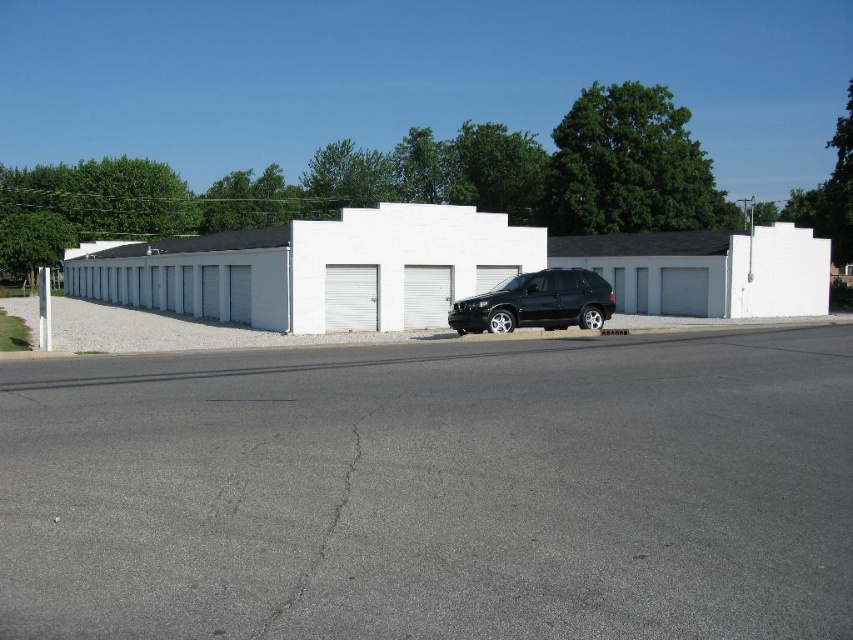
Find the location of `black matte suv at center`. black matte suv at center is located at coordinates click(537, 301).

Does black matte suv at center appear under gray metallic garage door at center?

Indeed, black matte suv at center is positioned under gray metallic garage door at center.

Is point (607, 292) farther from camera compared to point (677, 301)?

No.

You are a GUI agent. You are given a task and a screenshot of the screen. Output one action in this format:
    pyautogui.click(x=<x>, y=<y>)
    Task: Click on the black matte suv at center
    Image resolution: width=853 pixels, height=640 pixels.
    Given the screenshot: What is the action you would take?
    pyautogui.click(x=537, y=301)

Between black matte suv at center and white rolling door at center, which one appears on the right side from the viewer's perspective?

From the viewer's perspective, black matte suv at center appears more on the right side.

Describe the element at coordinates (537, 301) in the screenshot. I see `black matte suv at center` at that location.

Who is more forward, (469, 332) or (431, 292)?

Positioned in front is point (469, 332).

Find the location of a particular element. The image size is (853, 640). black matte suv at center is located at coordinates (537, 301).

The height and width of the screenshot is (640, 853). What do you see at coordinates (399, 264) in the screenshot? I see `white matte garage door at center` at bounding box center [399, 264].

Is white matte garage door at center to the right of white metallic garage door at center from the viewer's perspective?

Correct, you'll find white matte garage door at center to the right of white metallic garage door at center.

Between point (316, 310) and point (374, 288), which one is positioned behind?

The point (374, 288) is more distant.

At what (x,y) coordinates should I click in order to perform the action: click on white matte garage door at center. Please return your answer as a coordinate pair (x, y). This screenshot has width=853, height=640. Looking at the image, I should click on (399, 264).